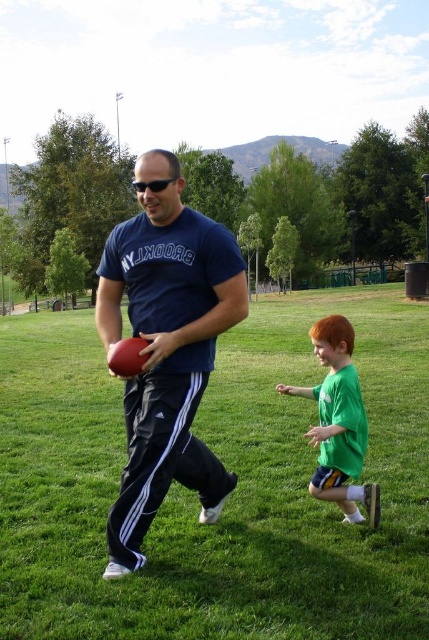
Does green grass at center appear on the right side of green matte shirt at right?

Incorrect, green grass at center is not on the right side of green matte shirt at right.

The image size is (429, 640). Describe the element at coordinates (230, 496) in the screenshot. I see `green grass at center` at that location.

Is point (79, 586) behind point (352, 428)?

No, it is not.

What are the coordinates of `green grass at center` in the screenshot? It's located at (230, 496).

How far apart are green grass at center and matte blue t-shirt at center?

7.74 meters

Looking at this image, between green grass at center and matte blue t-shirt at center, which one is positioned higher?

green grass at center

Where is `green grass at center`? green grass at center is located at coordinates (230, 496).

How much distance is there between matte blue t-shirt at center and green matte shirt at right?

matte blue t-shirt at center is 90.11 centimeters from green matte shirt at right.

Can you confirm if matte blue t-shirt at center is thinner than green matte shirt at right?

Correct, matte blue t-shirt at center's width is less than green matte shirt at right's.

Who is more forward, (123, 236) or (352, 396)?

Point (123, 236)

This screenshot has width=429, height=640. What are the coordinates of `matte blue t-shirt at center` in the screenshot? It's located at (166, 349).